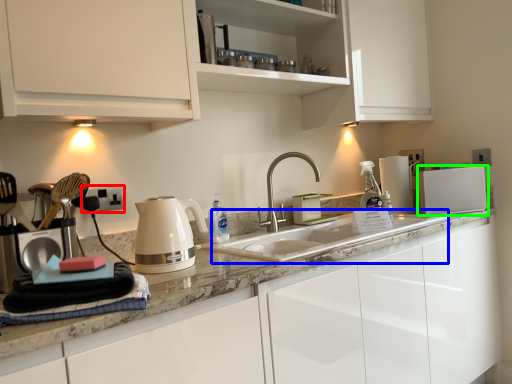
Question: Which is nearer to the electric outlet (highlighted by a red box)? sink (highlighted by a blue box) or kitchen appliance (highlighted by a green box).

Choices:
 (A) sink
 (B) kitchen appliance

Answer: (A)